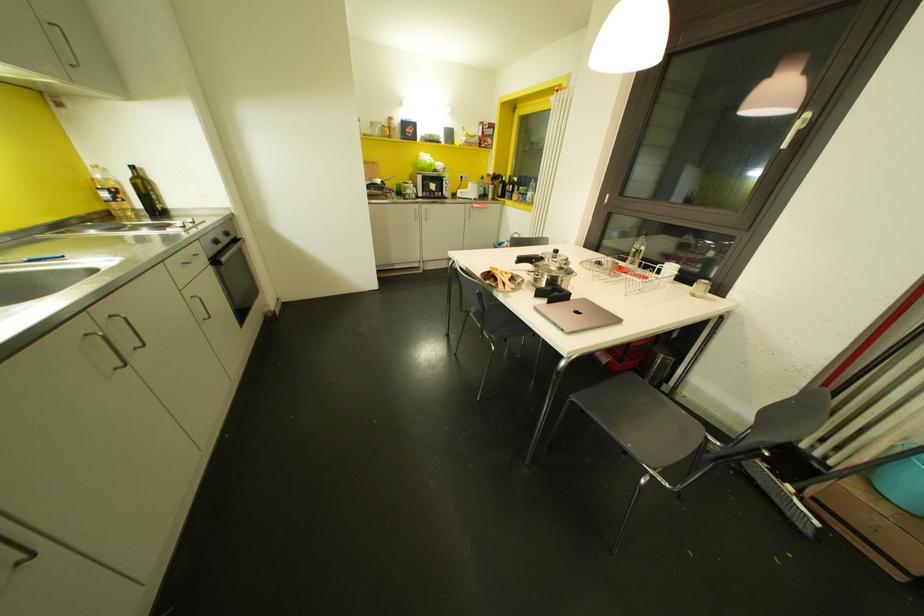
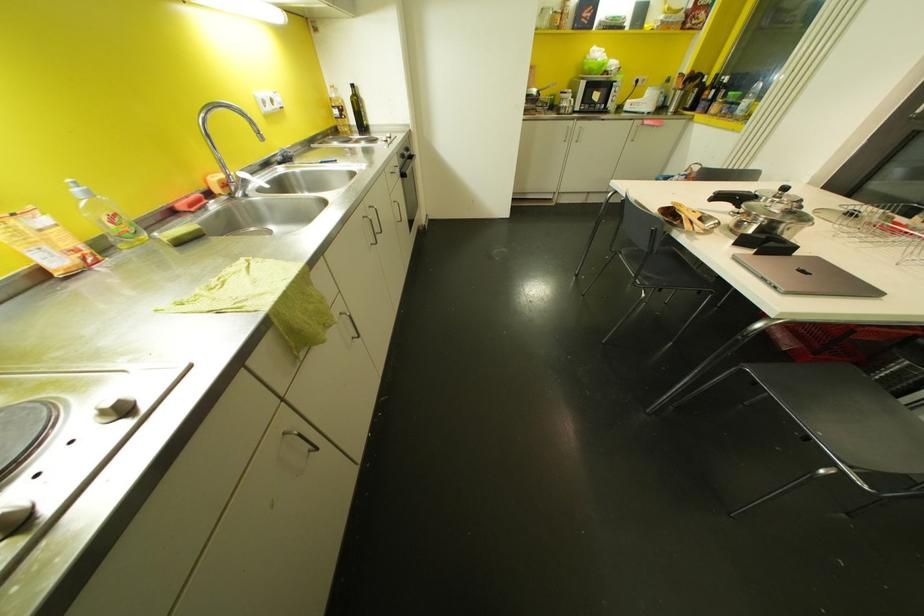
Where in the second image is the point corresponding to [505,339] from the first image?

(660, 290)